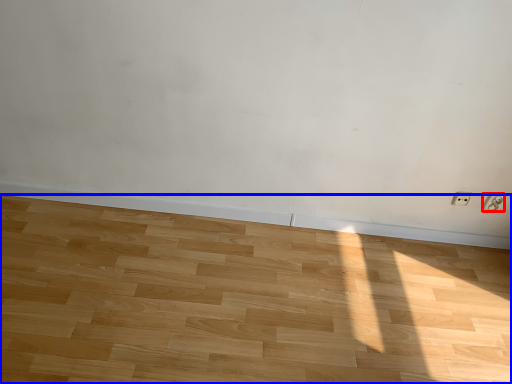
Question: Which of the following is the farthest to the observer, electric outlet (highlighted by a red box) or hardwood (highlighted by a blue box)?

Choices:
 (A) electric outlet
 (B) hardwood

Answer: (A)